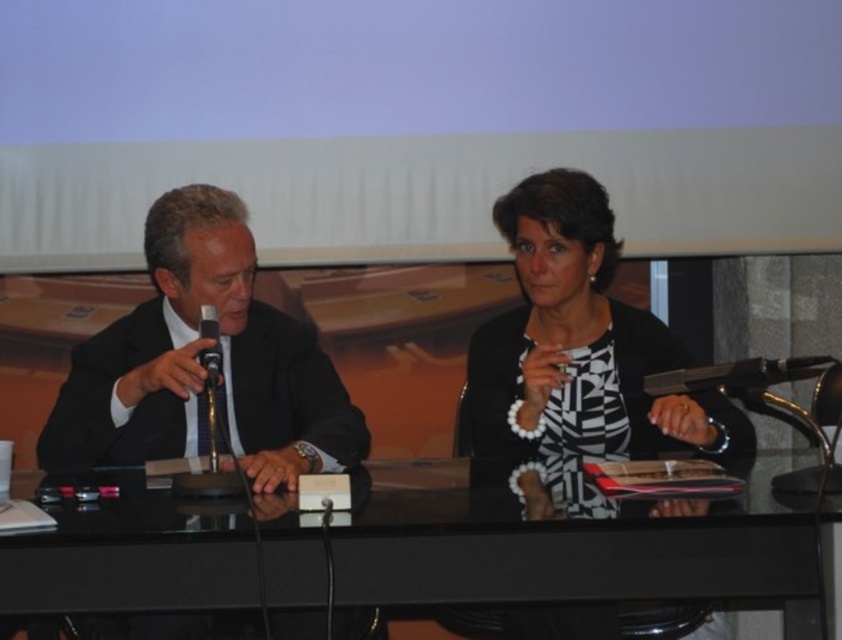
Question: Can you confirm if black suit at left is thinner than black plastic microphone at left?

Choices:
 (A) no
 (B) yes

Answer: (A)

Question: Which point is closer to the camera taking this photo?

Choices:
 (A) (534, 218)
 (B) (206, 365)
 (C) (398, 554)

Answer: (C)

Question: Which point is farther from the camera taking this photo?

Choices:
 (A) (240, 560)
 (B) (611, 428)
 (C) (206, 326)

Answer: (B)

Question: Which object is positioned farthest from the black glass table at center?

Choices:
 (A) black suit at left
 (B) black and white striped blouse at center
 (C) black plastic microphone at left

Answer: (C)

Question: Where is black glass table at center located in relation to black plastic microphone at left in the image?

Choices:
 (A) right
 (B) left

Answer: (A)

Question: Can you confirm if black glass table at center is positioned to the left of black and white striped blouse at center?

Choices:
 (A) yes
 (B) no

Answer: (A)